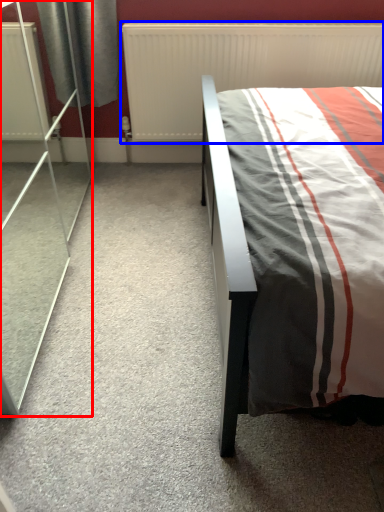
Question: Which object is closer to the camera taking this photo, screen door (highlighted by a red box) or radiator (highlighted by a blue box)?

Choices:
 (A) screen door
 (B) radiator

Answer: (A)